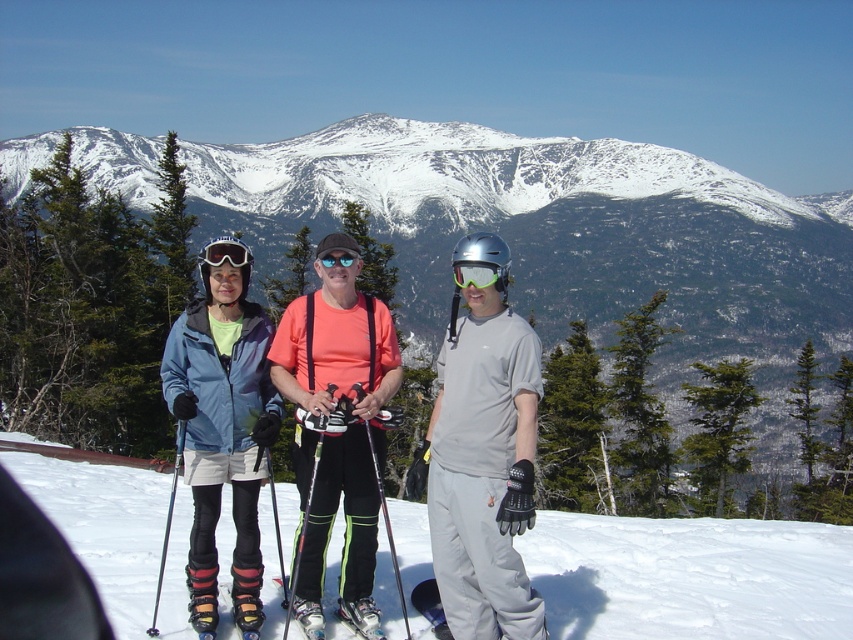
Question: Among these points, which one is nearest to the camera?

Choices:
 (A) (196, 554)
 (B) (230, 257)
 (C) (830, 236)
 (D) (375, 465)

Answer: (A)

Question: Which object appears farthest from the camera in this image?

Choices:
 (A) matte blue ski jacket at left
 (B) metallic silver ski pole at center
 (C) blue reflective lens goggles at center
 (D) matte black goggles at center

Answer: (C)

Question: In this image, where is metallic silver ski pole at center located relative to matte black goggles at center?

Choices:
 (A) below
 (B) above

Answer: (A)

Question: Among these objects, which one is nearest to the camera?

Choices:
 (A) snowy mountain at center
 (B) blue reflective lens goggles at center
 (C) metallic silver ski pole at center
 (D) transparent plastic goggles at center

Answer: (C)

Question: Does transparent plastic goggles at center appear on the right side of blue reflective lens goggles at center?

Choices:
 (A) no
 (B) yes

Answer: (B)

Question: Does matte gray snowboard at center lie behind transparent plastic goggles at center?

Choices:
 (A) no
 (B) yes

Answer: (A)